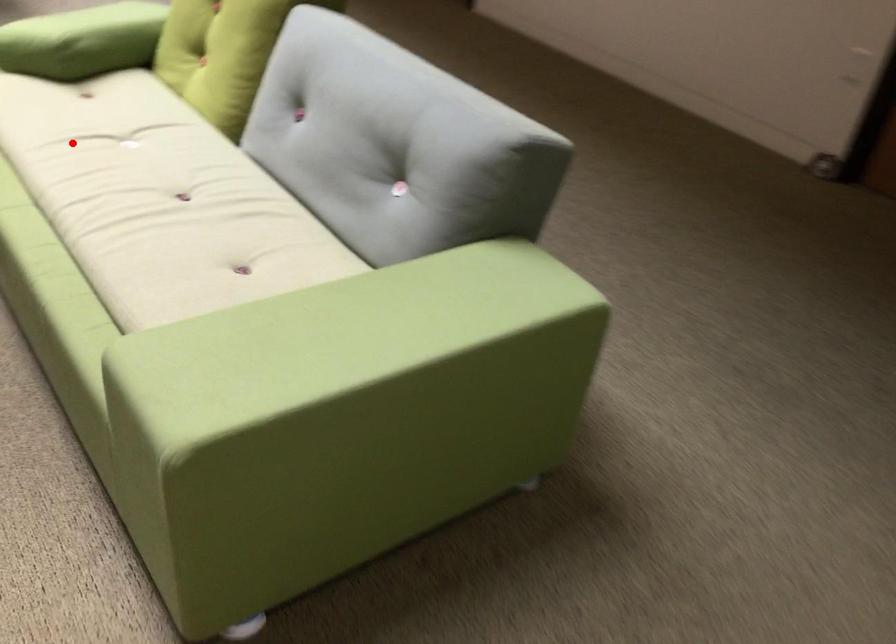
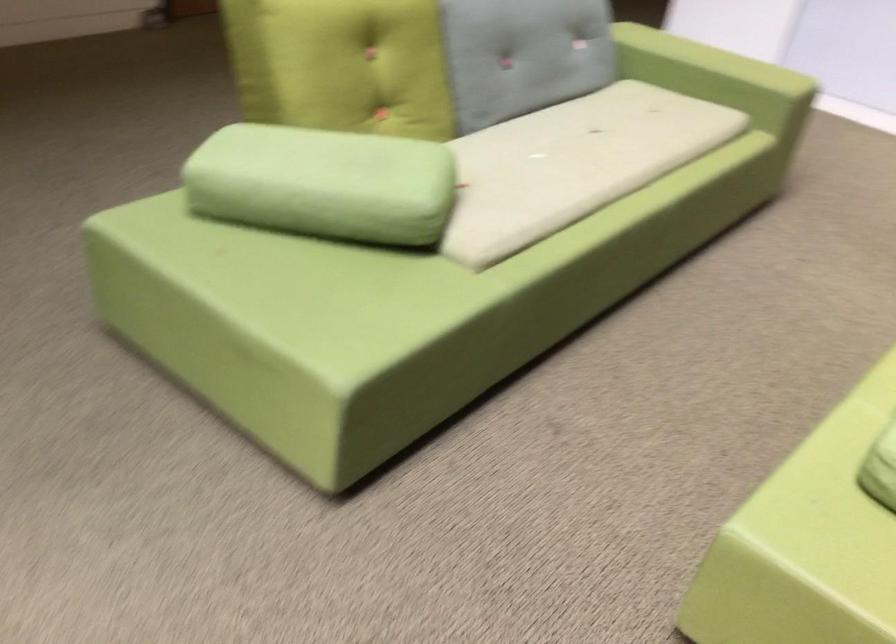
The point at the highlighted location is marked in the first image. Where is the corresponding point in the second image?

(572, 164)